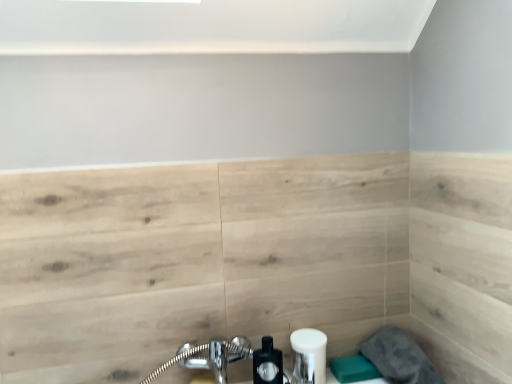
Question: Considering the positions of gray fabric towel at lower right and white matte soap dispenser at lower center in the image, is gray fabric towel at lower right bigger or smaller than white matte soap dispenser at lower center?

Choices:
 (A) big
 (B) small

Answer: (A)

Question: From a real-world perspective, is gray fabric towel at lower right physically located above or below white matte soap dispenser at lower center?

Choices:
 (A) below
 (B) above

Answer: (A)

Question: Estimate the real-world distances between objects in this image. Which object is farther from the gray fabric towel at lower right?

Choices:
 (A) white matte soap dispenser at lower center
 (B) matte black soap dispenser at lower center

Answer: (B)

Question: Which object is the closest to the gray fabric towel at lower right?

Choices:
 (A) white matte soap dispenser at lower center
 (B) matte black soap dispenser at lower center

Answer: (A)